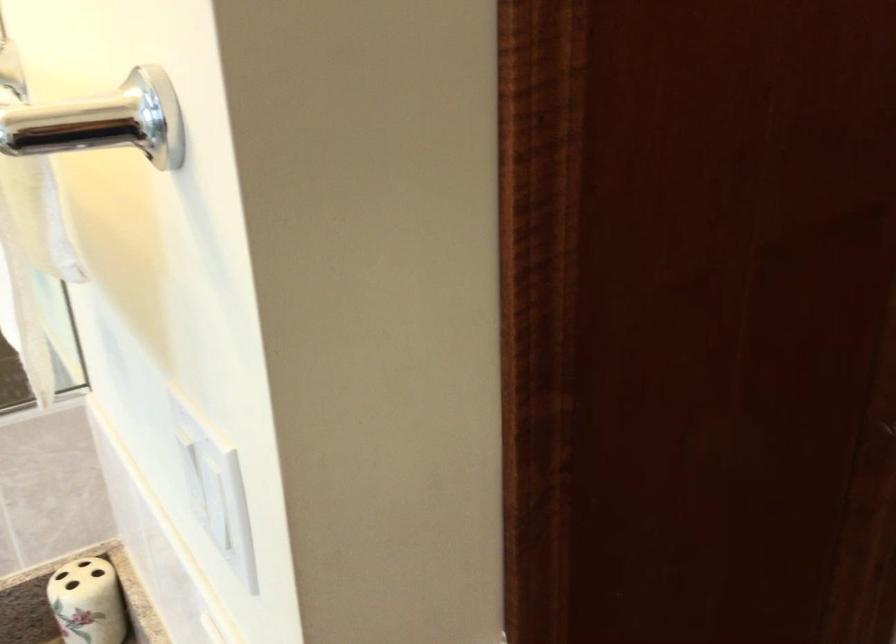
Find the location of `white light switch`. white light switch is located at coordinates (205, 489).